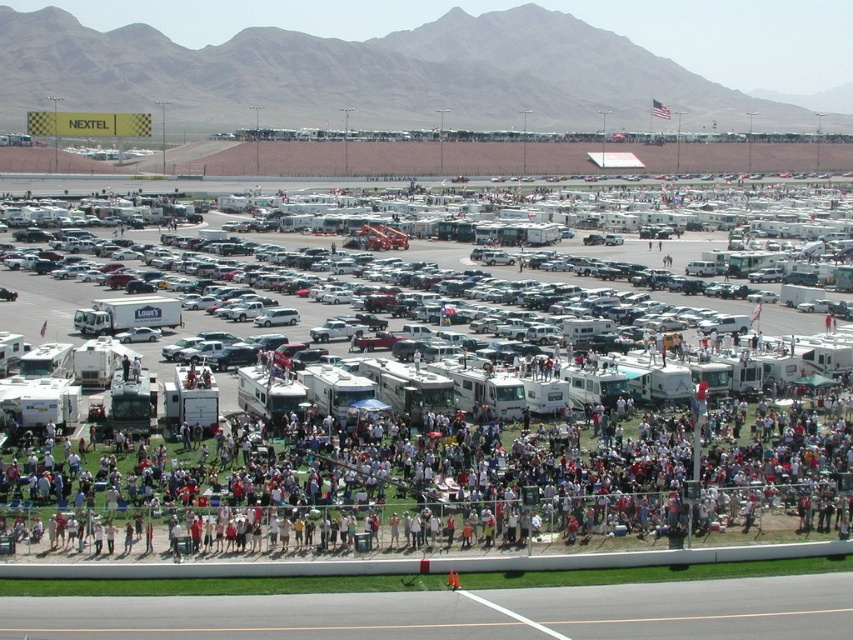
You are planning to take a photo of the white matte rv at center and the white matte recreational vehicle at center from the mountain backdrop. Which one should you focus on to ensure it appears bigger in the photo?

The white matte rv at center should be focused on because it is larger in size than the white matte recreational vehicle at center, so it will appear bigger in the photo.

You are a guest at the event and want to find the tallest vehicle between the white matte rv at center and the white matte recreational vehicle at center. Which one should you look for?

The white matte rv at center is much taller than the white matte recreational vehicle at center, so you should look for the white matte rv at center.

From the picture: You are a photographer at the event and want to take a photo that includes both the white matte rv at center and the white matte recreational vehicle at center. Which one should be positioned closer to the camera to ensure both are fully visible in the frame?

The white matte rv at center should be positioned closer to the camera because it is in front of the white matte recreational vehicle at center, allowing both to be captured clearly in the photo.